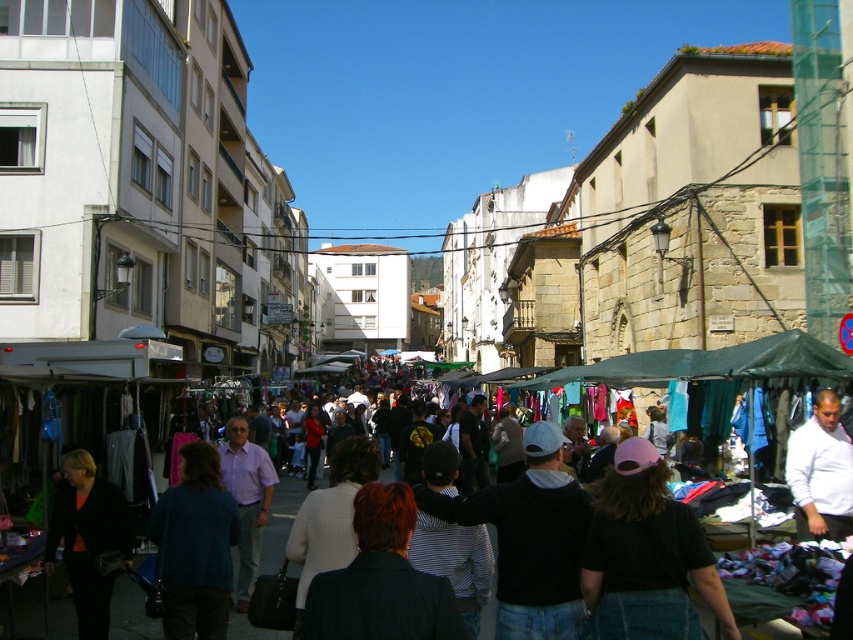
Between black matte cap at center and white matte shirt at center-right, which one has more height?

black matte cap at center is taller.

Who is positioned more to the left, black matte cap at center or white matte shirt at center-right?

From the viewer's perspective, black matte cap at center appears more on the left side.

Identify the location of black matte cap at center. (646, 548).

The image size is (853, 640). I want to click on white matte shirt at center-right, so click(x=821, y=472).

Does black leather jacket at lower left have a greater height compared to white matte shirt at center-right?

Indeed, black leather jacket at lower left has a greater height compared to white matte shirt at center-right.

Between black leather jacket at lower left and white matte shirt at center-right, which one is positioned higher?

white matte shirt at center-right is above.

Looking at this image, who is more forward, (83,516) or (809,433)?

Point (83,516) is more forward.

The image size is (853, 640). What are the coordinates of `black leather jacket at lower left` in the screenshot? It's located at [x=86, y=538].